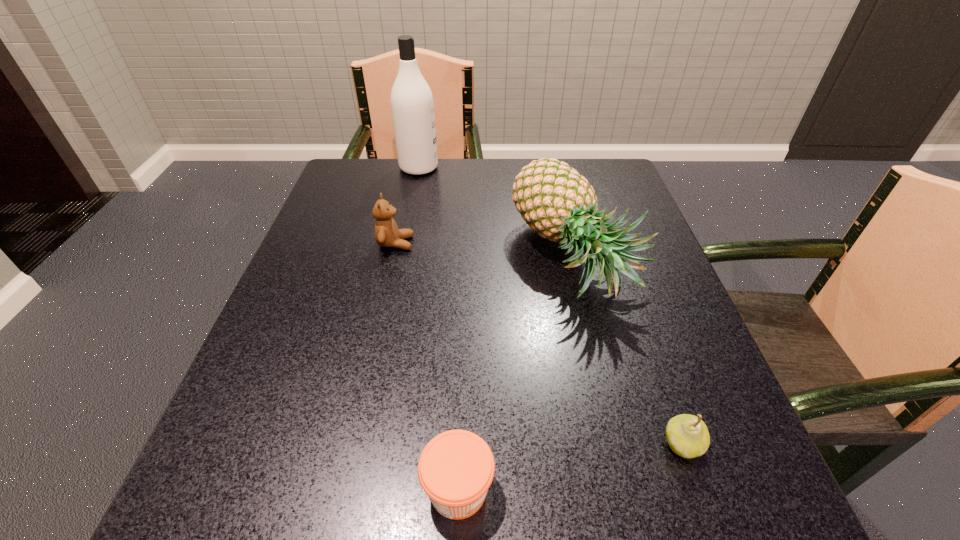
Where is `free space that is in between the shampoo and the pear`? Image resolution: width=960 pixels, height=540 pixels. free space that is in between the shampoo and the pear is located at coordinates (551, 306).

Find the location of a particular element. empty space between the third tallest object and the shortest object is located at coordinates (427, 366).

The width and height of the screenshot is (960, 540). In order to click on free area in between the third object from left to right and the fourth tallest object in this screenshot , I will do `click(570, 467)`.

The width and height of the screenshot is (960, 540). I want to click on free spot between the fourth tallest object and the third shortest object, so click(x=539, y=343).

Identify the location of free space that is in between the shortest object and the second tallest object. (516, 373).

Select which object appears as the third closest to the third tallest object. Please provide its 2D coordinates. Your answer should be formatted as a tuple, i.e. [(x, y)], where the tuple contains the x and y coordinates of a point satisfying the conditions above.

[(456, 468)]

Point out which object is positioned as the third nearest to the farthest object. Please provide its 2D coordinates. Your answer should be formatted as a tuple, i.e. [(x, y)], where the tuple contains the x and y coordinates of a point satisfying the conditions above.

[(456, 468)]

The image size is (960, 540). In order to click on free space that satisfies the following two spatial constraints: 1. on the back side of the second tallest object; 2. on the front-facing side of the farthest object in this screenshot , I will do `click(553, 167)`.

The width and height of the screenshot is (960, 540). I want to click on vacant space that satisfies the following two spatial constraints: 1. on the front-facing side of the fourth tallest object; 2. on the right side of the teddy bear, so click(350, 443).

At what (x,y) coordinates should I click in order to perform the action: click on vacant space that satisfies the following two spatial constraints: 1. on the front-facing side of the fourth tallest object; 2. on the left side of the shampoo. Please return your answer as a coordinate pair (x, y). Looking at the image, I should click on (363, 443).